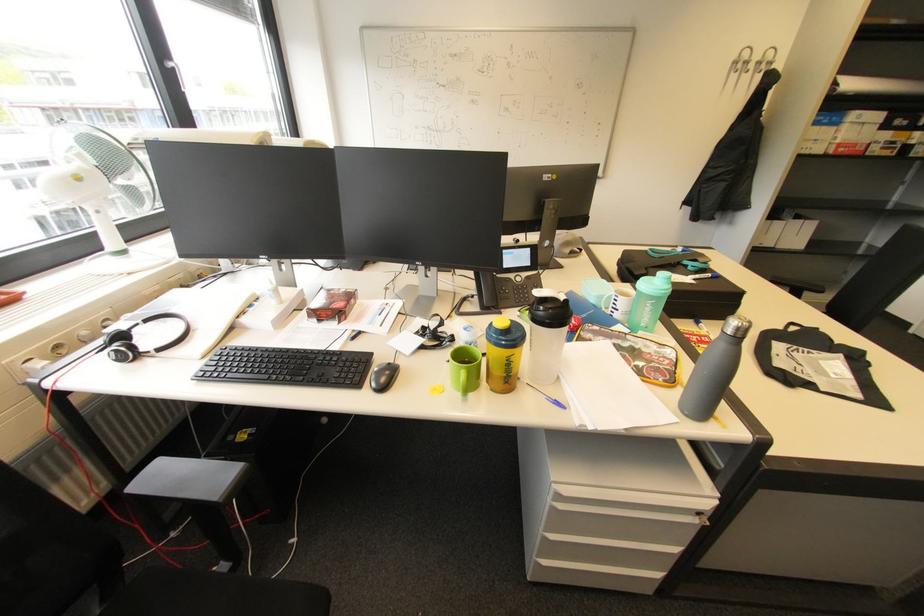
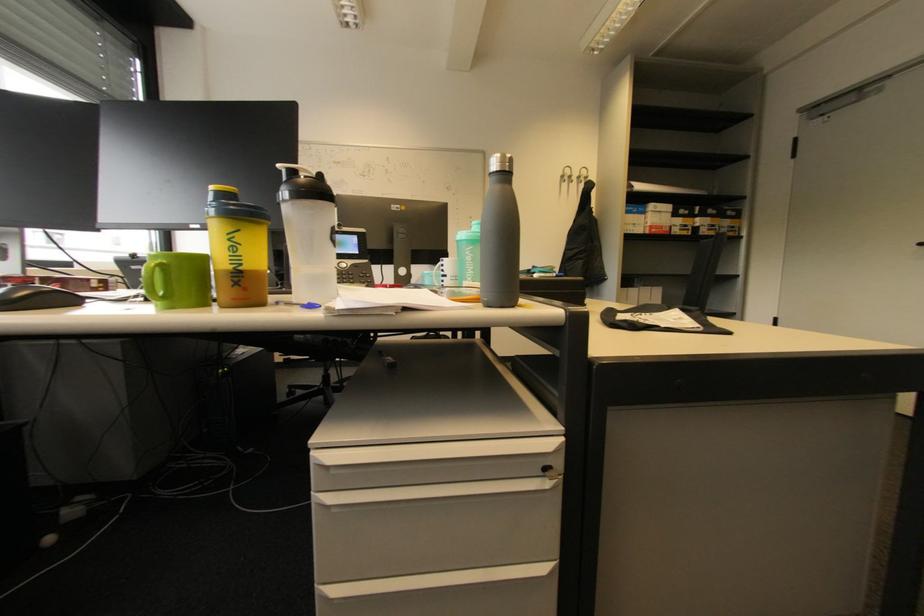
Question: The first image is from the beginning of the video and the second image is from the end. How did the camera likely rotate when shooting the video?

Choices:
 (A) Left
 (B) Right
 (C) Up
 (D) Down

Answer: (C)